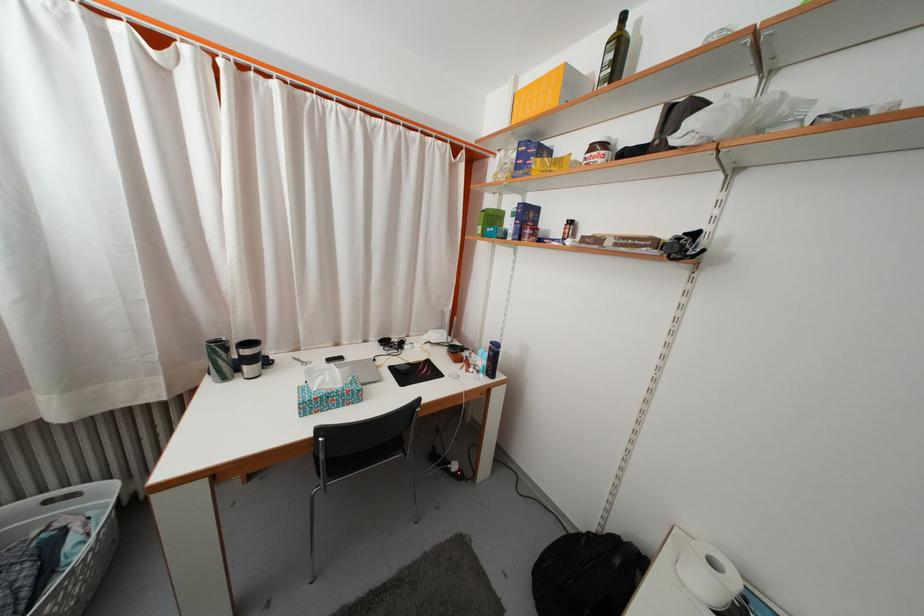
Locate an element on the screen. The width and height of the screenshot is (924, 616). small scissors is located at coordinates (300, 361).